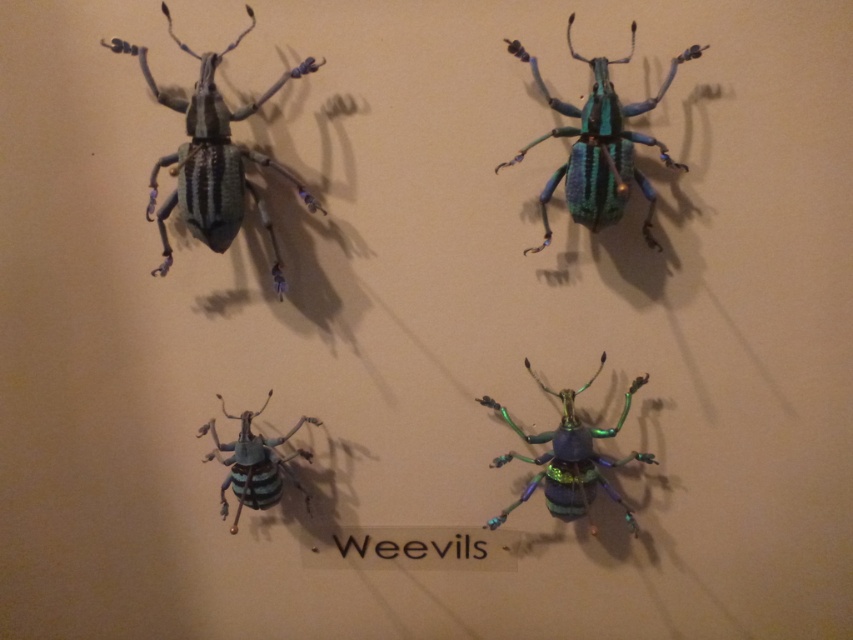
Can you confirm if matte black beetle at upper left is thinner than matte green beetle at center?

In fact, matte black beetle at upper left might be wider than matte green beetle at center.

Can you confirm if matte black beetle at upper left is positioned to the right of matte green beetle at center?

Incorrect, matte black beetle at upper left is not on the right side of matte green beetle at center.

At what (x,y) coordinates should I click in order to perform the action: click on matte black beetle at upper left. Please return your answer as a coordinate pair (x, y). This screenshot has height=640, width=853. Looking at the image, I should click on (213, 157).

Can you confirm if matte black beetle at upper left is taller than metallic iridescent weevil at center?

Yes, matte black beetle at upper left is taller than metallic iridescent weevil at center.

This screenshot has width=853, height=640. Describe the element at coordinates (213, 157) in the screenshot. I see `matte black beetle at upper left` at that location.

The image size is (853, 640). In order to click on matte black beetle at upper left in this screenshot , I will do `click(213, 157)`.

Where is `matte black beetle at upper left`? matte black beetle at upper left is located at coordinates (213, 157).

Can you confirm if metallic blue-green beetle at upper center is smaller than matte green beetle at center?

Actually, metallic blue-green beetle at upper center might be larger than matte green beetle at center.

Is metallic blue-green beetle at upper center positioned behind matte green beetle at center?

No, it is not.

Is point (614, 221) farther from viewer compared to point (196, 429)?

That is False.

Where is `metallic blue-green beetle at upper center`? This screenshot has width=853, height=640. metallic blue-green beetle at upper center is located at coordinates click(x=599, y=145).